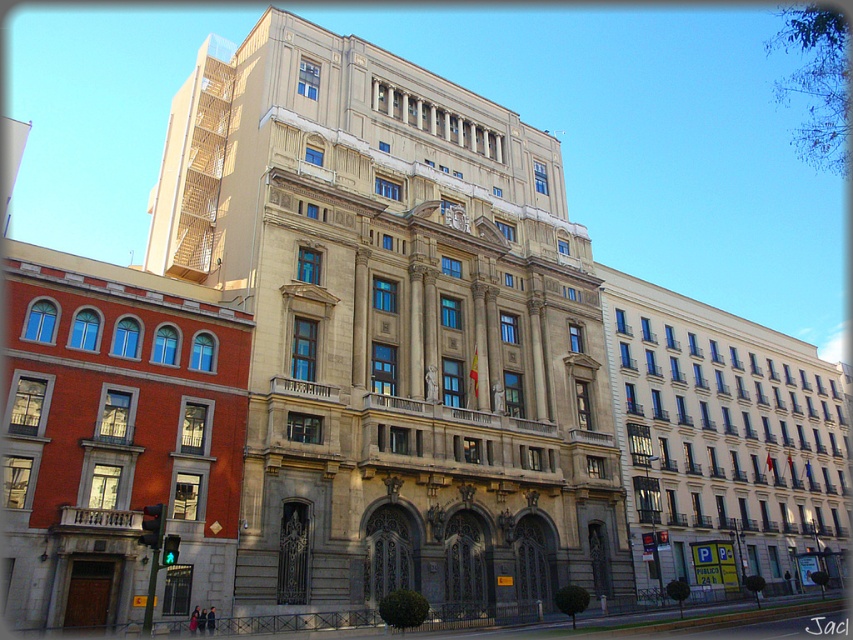
Question: Among these points, which one is farthest from the camera?

Choices:
 (A) (576, 445)
 (B) (451, 221)

Answer: (B)

Question: Which object is closer to the camera taking this photo?

Choices:
 (A) beige stone building at center
 (B) gold metallic clock at center

Answer: (A)

Question: Is beige stone building at center wider than gold metallic clock at center?

Choices:
 (A) yes
 (B) no

Answer: (A)

Question: Does beige stone building at center have a smaller size compared to gold metallic clock at center?

Choices:
 (A) yes
 (B) no

Answer: (B)

Question: Which point is farther from the camera taking this photo?

Choices:
 (A) click(x=445, y=212)
 (B) click(x=567, y=262)

Answer: (B)

Question: Where is beige stone building at center located in relation to gold metallic clock at center in the image?

Choices:
 (A) left
 (B) right

Answer: (A)